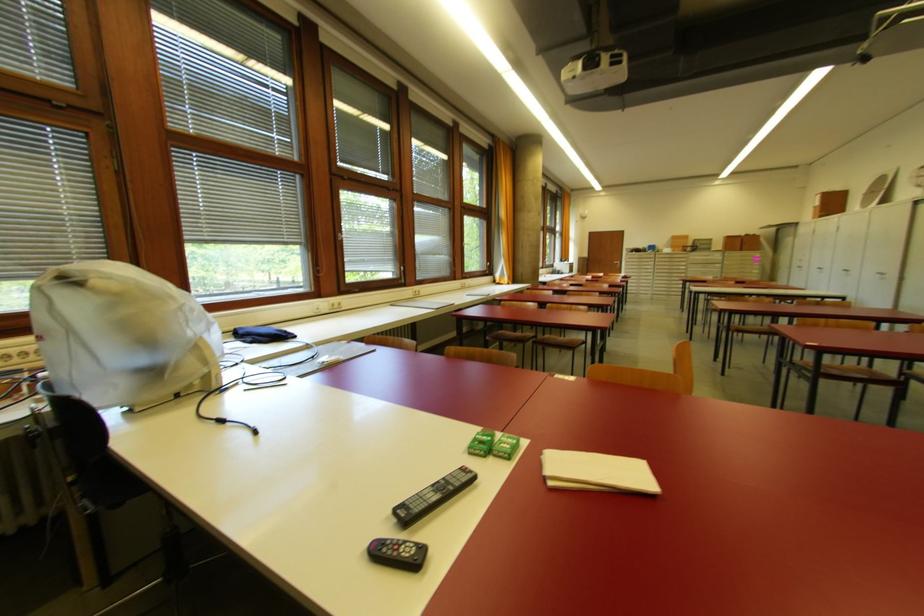
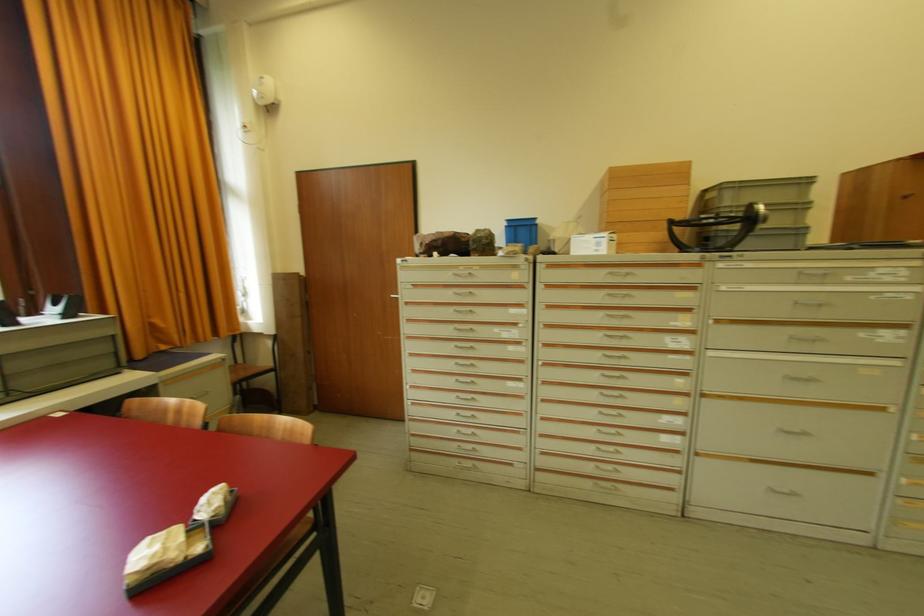
The point at (664, 254) is marked in the first image. Where is the corresponding point in the second image?

(570, 254)